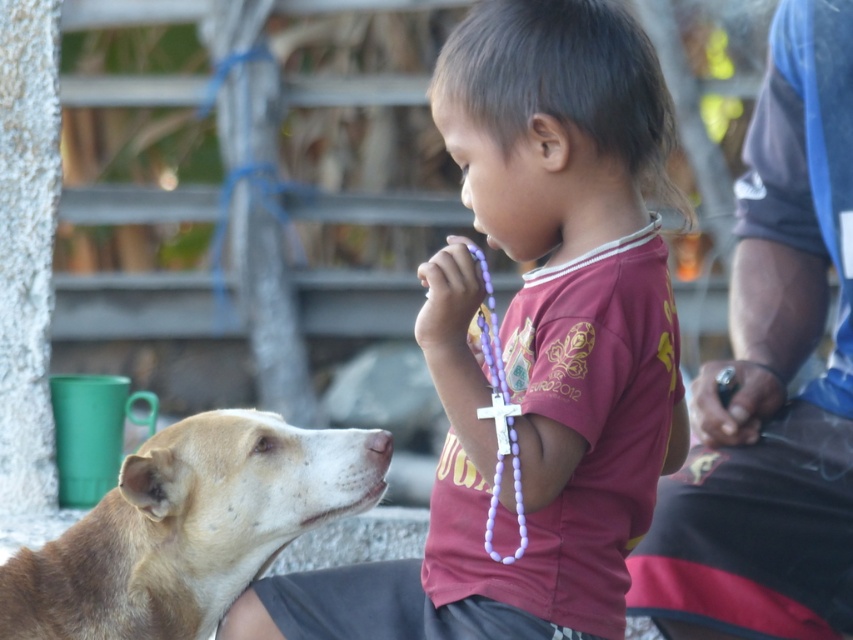
Question: Can you confirm if purple plastic rosary at center is wider than brown furry dog at lower left?

Choices:
 (A) yes
 (B) no

Answer: (A)

Question: Which of the following is the closest to the observer?

Choices:
 (A) purple plastic rosary at center
 (B) brown furry dog at lower left

Answer: (A)

Question: Which point is closer to the camera taking this photo?

Choices:
 (A) click(x=682, y=458)
 (B) click(x=311, y=516)

Answer: (B)

Question: Is purple plastic rosary at center behind brown furry dog at lower left?

Choices:
 (A) no
 (B) yes

Answer: (A)

Question: Is purple plastic rosary at center closer to camera compared to brown furry dog at lower left?

Choices:
 (A) no
 (B) yes

Answer: (B)

Question: Which object appears closest to the camera in this image?

Choices:
 (A) purple plastic rosary at center
 (B) brown furry dog at lower left

Answer: (A)